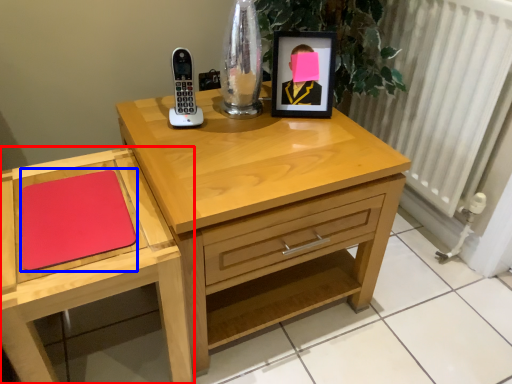
Question: Among these objects, which one is farthest to the camera, chest of drawers (highlighted by a red box) or notepad (highlighted by a blue box)?

Choices:
 (A) chest of drawers
 (B) notepad

Answer: (B)